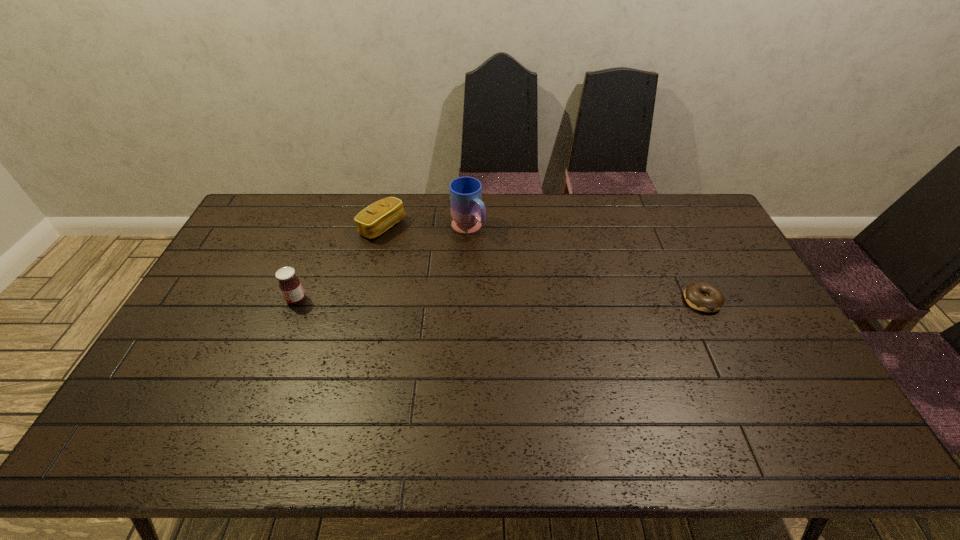
Locate an element on the screen. The image size is (960, 540). object situated at the right edge is located at coordinates (701, 296).

This screenshot has height=540, width=960. Find the location of `vacant space at the far edge`. vacant space at the far edge is located at coordinates click(x=549, y=215).

The image size is (960, 540). In the image, there is a desktop. What are the coordinates of `free space at the near edge` in the screenshot? It's located at (708, 402).

Identify the location of blank area at the left edge. Image resolution: width=960 pixels, height=540 pixels. (235, 321).

This screenshot has height=540, width=960. In the image, there is a desktop. Find the location of `vacant space at the right edge`. vacant space at the right edge is located at coordinates point(695,253).

You are a GUI agent. You are given a task and a screenshot of the screen. Output one action in this format:
    pyautogui.click(x=<x>, y=<y>)
    Task: Click on the vacant area at the far right corner
    This screenshot has width=960, height=540.
    Given the screenshot: What is the action you would take?
    pyautogui.click(x=693, y=207)

The width and height of the screenshot is (960, 540). I want to click on empty space that is in between the second object from right to left and the leftmost object, so click(x=382, y=264).

The image size is (960, 540). Find the location of `vacant area that lies between the leftmost object and the mug`. vacant area that lies between the leftmost object and the mug is located at coordinates (382, 264).

Identify the location of vacant space that's between the third object from right to left and the jam. (339, 264).

Locate an element on the screen. The image size is (960, 540). free space between the third object from right to left and the leftmost object is located at coordinates (339, 264).